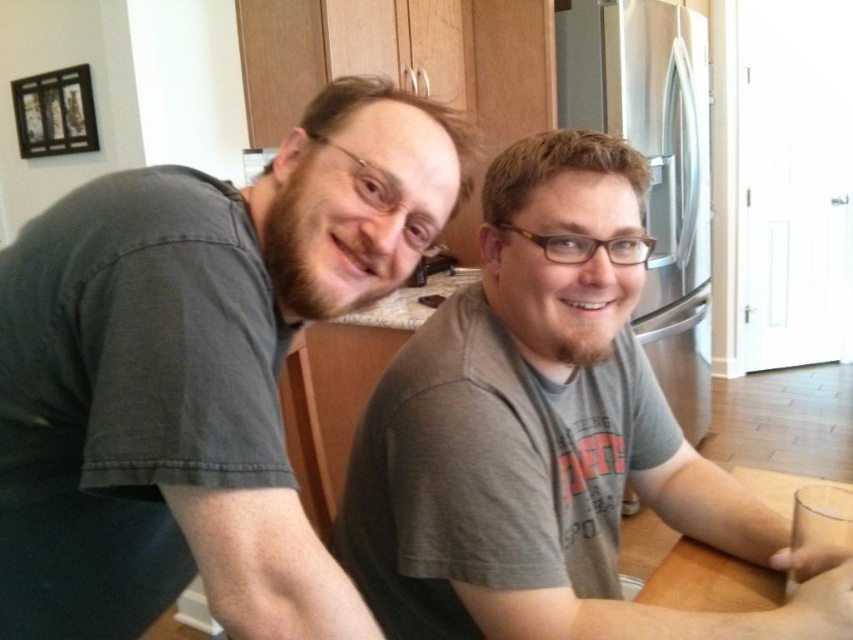
You are standing in the kitchen and want to place a small sticker exactly at the point marked as point [196,371]. Based on the scene description, where should you place the sticker?

The point [196,371] is on the dark gray t shirt at left, so place the sticker on the dark gray t shirt at left.